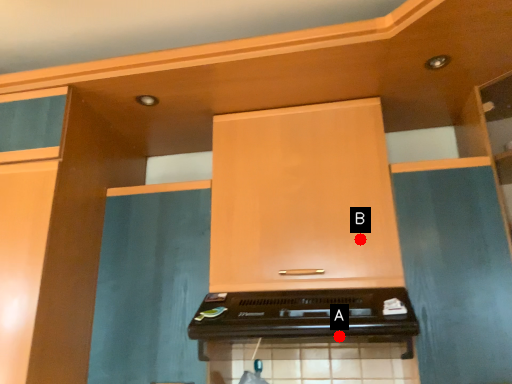
Question: Two points are circled on the image, labeled by A and B beside each circle. Among these points, which one is nearest to the camera?

Choices:
 (A) A is closer
 (B) B is closer

Answer: (A)